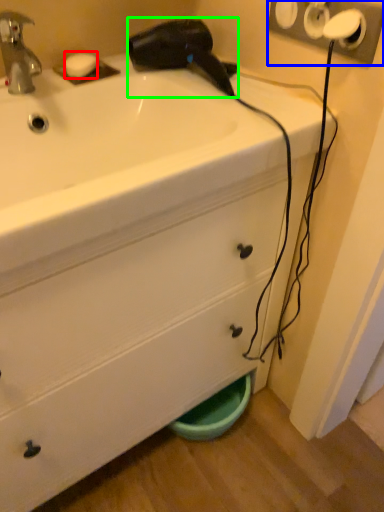
Question: Which object is the farthest from soap (highlighted by a red box)? Choose among these: electric outlet (highlighted by a blue box) or hair drier (highlighted by a green box).

Choices:
 (A) electric outlet
 (B) hair drier

Answer: (A)